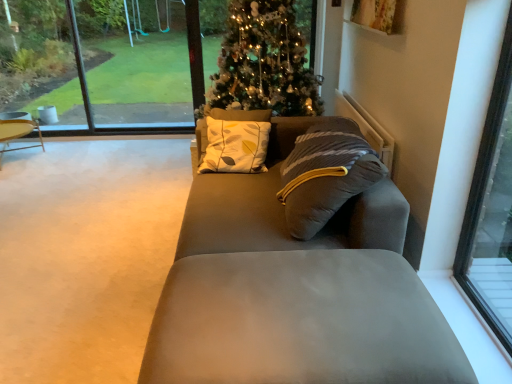
Question: Is transparent glass window at right, positioned as the first window in bottom-to-top order, positioned in front of iridescent glass christmas tree at center?

Choices:
 (A) no
 (B) yes

Answer: (B)

Question: From the image's perspective, is transparent glass window at right, the 2th window when ordered from top to bottom, under iridescent glass christmas tree at center?

Choices:
 (A) no
 (B) yes

Answer: (B)

Question: Is transparent glass window at right, marked as the second window in a back-to-front arrangement, far from iridescent glass christmas tree at center?

Choices:
 (A) yes
 (B) no

Answer: (A)

Question: Does transparent glass window at right, the second window positioned from the left, have a larger size compared to iridescent glass christmas tree at center?

Choices:
 (A) yes
 (B) no

Answer: (B)

Question: Considering the relative sizes of transparent glass window at right, marked as the second window in a back-to-front arrangement, and iridescent glass christmas tree at center in the image provided, is transparent glass window at right, marked as the second window in a back-to-front arrangement, thinner than iridescent glass christmas tree at center?

Choices:
 (A) yes
 (B) no

Answer: (A)

Question: From a real-world perspective, does transparent glass window at right, marked as the second window in a back-to-front arrangement, stand above iridescent glass christmas tree at center?

Choices:
 (A) yes
 (B) no

Answer: (A)

Question: Is transparent glass window at upper left located outside transparent glass window at right, marked as the second window in a back-to-front arrangement?

Choices:
 (A) no
 (B) yes

Answer: (B)

Question: From a real-world perspective, is transparent glass window at upper left positioned over transparent glass window at right, marked as the second window in a back-to-front arrangement, based on gravity?

Choices:
 (A) no
 (B) yes

Answer: (B)

Question: Does transparent glass window at upper left have a greater width compared to transparent glass window at right, the 2th window when ordered from top to bottom?

Choices:
 (A) no
 (B) yes

Answer: (B)

Question: Would you say transparent glass window at upper left contains transparent glass window at right, the 2th window when ordered from top to bottom?

Choices:
 (A) yes
 (B) no

Answer: (B)

Question: From the image's perspective, does transparent glass window at upper left appear lower than transparent glass window at right, positioned as the first window in bottom-to-top order?

Choices:
 (A) no
 (B) yes

Answer: (A)

Question: Could you tell me if transparent glass window at upper left is facing transparent glass window at right, the 1th window when ordered from front to back?

Choices:
 (A) no
 (B) yes

Answer: (A)

Question: Considering the relative sizes of wooden round table at left and transparent glass window at upper left in the image provided, is wooden round table at left wider than transparent glass window at upper left?

Choices:
 (A) yes
 (B) no

Answer: (A)